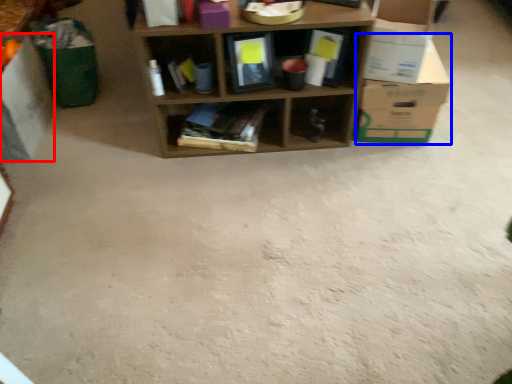
Question: Which object is closer to the camera taking this photo, cardboard box (highlighted by a red box) or cardboard box (highlighted by a blue box)?

Choices:
 (A) cardboard box
 (B) cardboard box

Answer: (A)